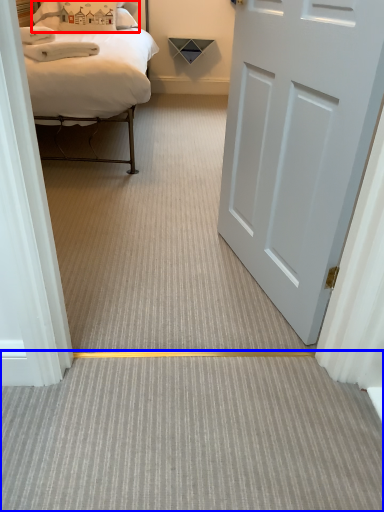
Question: Which object appears farthest to the camera in this image, pillow (highlighted by a red box) or plain (highlighted by a blue box)?

Choices:
 (A) pillow
 (B) plain

Answer: (A)